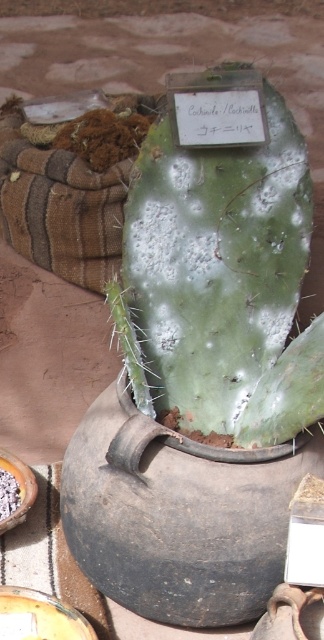
You are a gardener checking the health of the plants in the garden. You notice a point marked at coordinates (219, 273). Which plant does this point indicate?

The point marked at coordinates (219, 273) corresponds to the green matte cactus at center.

From the picture: You are a gardener who wants to transplant the green matte cactus at center into a new pot. The new pot you have is the same size as the white crumbly food at lower left. Will the new pot be big enough for the cactus?

The green matte cactus at center is wider than the white crumbly food at lower left. Since the new pot is the same size as the white crumbly food at lower left, it will not be large enough to accommodate the cactus.